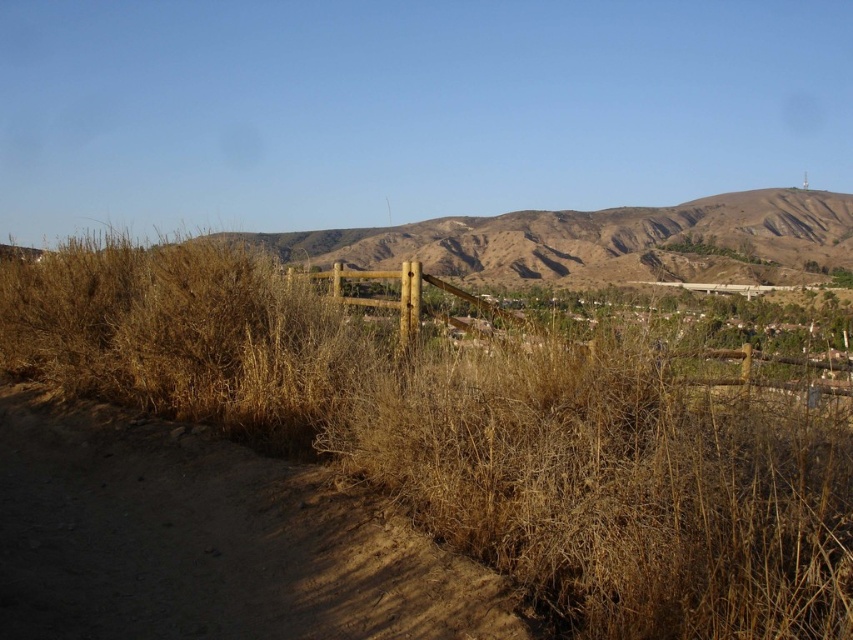
You are standing on the dirt path in the arid landscape and see the dry straw at center and the brown wooden fence at center. Which object is narrower?

The dry straw at center is narrower than the brown wooden fence at center.

You are standing on the dirt path and want to pick up the dry straw at center. Which direction should you go from the brown dirt track at lower left?

The dry straw at center is to the right of the brown dirt track at lower left, so you should go to the right to reach it.